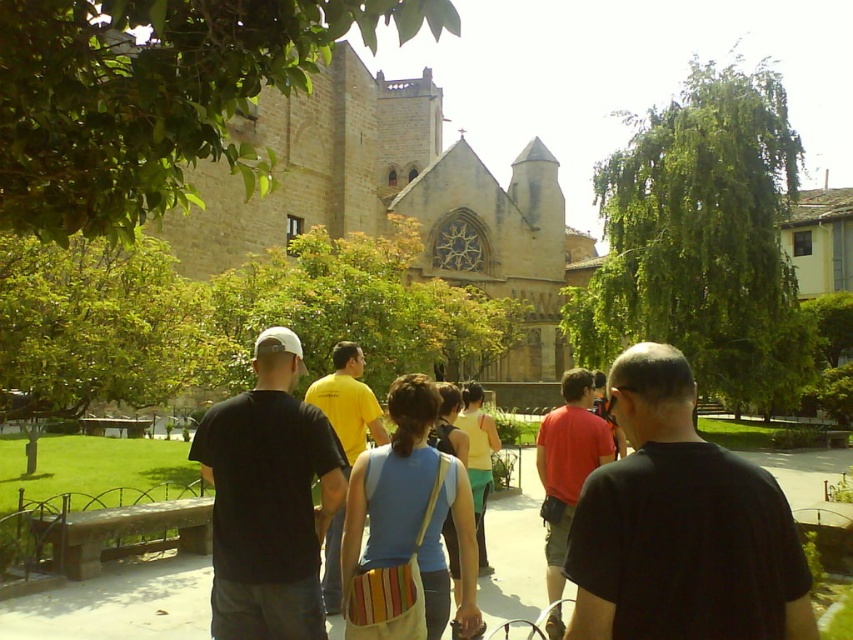
Question: Can you confirm if black matte shirt at center is positioned below blue cotton tank top at center?

Choices:
 (A) no
 (B) yes

Answer: (A)

Question: Does blue cotton tank top at center appear on the right side of red cotton shirt at center?

Choices:
 (A) yes
 (B) no

Answer: (B)

Question: Based on their relative distances, which object is nearer to the yellow cotton shirt at center?

Choices:
 (A) black matte t-shirt at center
 (B) brown stone church at center
 (C) blue cotton tank top at center

Answer: (C)

Question: Can you confirm if black matte t-shirt at center is positioned to the right of yellow cotton tank top at center?

Choices:
 (A) yes
 (B) no

Answer: (B)

Question: Which object is the farthest from the black matte shirt at center?

Choices:
 (A) black matte t-shirt at center
 (B) red cotton shirt at center
 (C) yellow cotton tank top at center

Answer: (A)

Question: Which point appears closest to the camera in this image?

Choices:
 (A) (463, 422)
 (B) (315, 401)

Answer: (B)